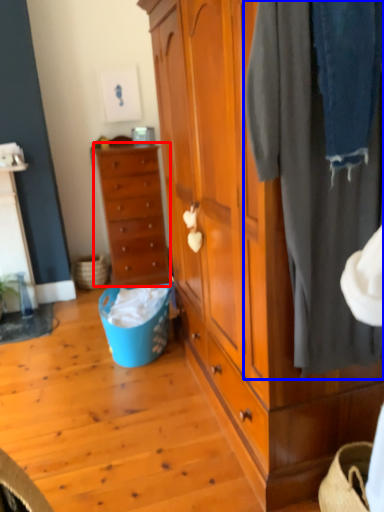
Question: Which object appears closest to the camera in this image, chest of drawers (highlighted by a red box) or clothing (highlighted by a blue box)?

Choices:
 (A) chest of drawers
 (B) clothing

Answer: (B)